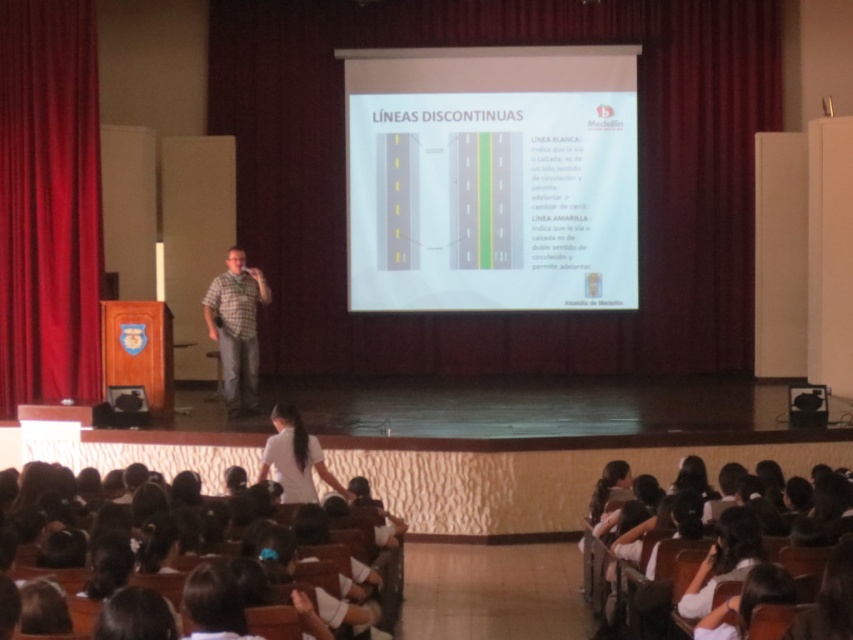
Is white paper at center to the left of plaid shirt at center from the viewer's perspective?

Incorrect, white paper at center is not on the left side of plaid shirt at center.

Is white paper at center further to the viewer compared to plaid shirt at center?

Yes.

I want to click on white paper at center, so click(x=491, y=179).

Where is `white paper at center`? The height and width of the screenshot is (640, 853). white paper at center is located at coordinates (491, 179).

Does white paper at center appear over velvet red curtain at left?

No.

Is point (416, 253) more distant than point (39, 104)?

Yes, it is behind point (39, 104).

Is point (502, 259) positioned after point (68, 332)?

Yes, point (502, 259) is behind point (68, 332).

I want to click on white paper at center, so click(x=491, y=179).

Does white uniform at lower right lie behind white uniform at lower center?

Yes, it is.

This screenshot has height=640, width=853. What are the coordinates of `white uniform at lower right` in the screenshot? It's located at (677, 525).